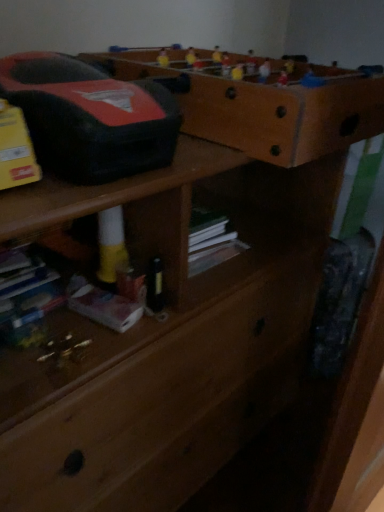
Question: Can you confirm if brown wooden shelf at upper center is smaller than white matte book at lower left?

Choices:
 (A) no
 (B) yes

Answer: (A)

Question: Can you confirm if brown wooden shelf at upper center is bigger than white matte book at lower left?

Choices:
 (A) no
 (B) yes

Answer: (B)

Question: Does brown wooden shelf at upper center have a greater height compared to white matte book at lower left?

Choices:
 (A) yes
 (B) no

Answer: (A)

Question: Would you say brown wooden shelf at upper center contains white matte book at lower left?

Choices:
 (A) yes
 (B) no

Answer: (B)

Question: Is brown wooden shelf at upper center at the left side of white matte book at lower left?

Choices:
 (A) no
 (B) yes

Answer: (A)

Question: Considering the relative positions of white matte book at lower left and brown wooden shelf at upper center in the image provided, is white matte book at lower left to the left or to the right of brown wooden shelf at upper center?

Choices:
 (A) right
 (B) left

Answer: (B)

Question: From the image's perspective, is white matte book at lower left above or below brown wooden shelf at upper center?

Choices:
 (A) below
 (B) above

Answer: (A)

Question: Is point (36, 309) positioned closer to the camera than point (304, 65)?

Choices:
 (A) farther
 (B) closer

Answer: (B)

Question: Considering the positions of white matte book at lower left and brown wooden shelf at upper center in the image, is white matte book at lower left bigger or smaller than brown wooden shelf at upper center?

Choices:
 (A) small
 (B) big

Answer: (A)

Question: Looking at their shapes, would you say brown wooden shelf at upper center is wider or thinner than white matte book at lower left?

Choices:
 (A) wide
 (B) thin

Answer: (A)

Question: Is brown wooden shelf at upper center situated inside white matte book at lower left or outside?

Choices:
 (A) inside
 (B) outside

Answer: (B)

Question: From the image's perspective, is brown wooden shelf at upper center positioned above or below white matte book at lower left?

Choices:
 (A) above
 (B) below

Answer: (A)

Question: Is point (203, 52) positioned closer to the camera than point (33, 275)?

Choices:
 (A) farther
 (B) closer

Answer: (A)

Question: Is brown wooden shelf at upper center spatially inside wooden chest of drawers at center, or outside of it?

Choices:
 (A) outside
 (B) inside

Answer: (B)

Question: Considering the positions of brown wooden shelf at upper center and wooden chest of drawers at center in the image, is brown wooden shelf at upper center bigger or smaller than wooden chest of drawers at center?

Choices:
 (A) small
 (B) big

Answer: (A)